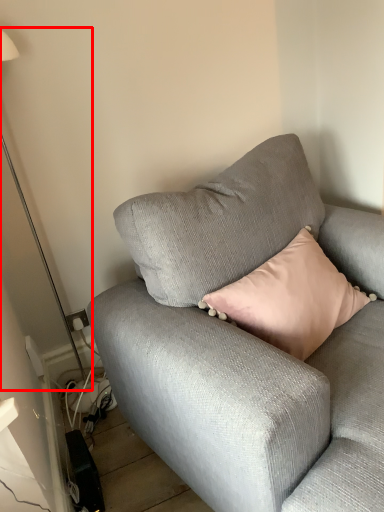
Question: From the image's perspective, where is table lamp (annotated by the red box) located relative to studio couch?

Choices:
 (A) above
 (B) below

Answer: (A)